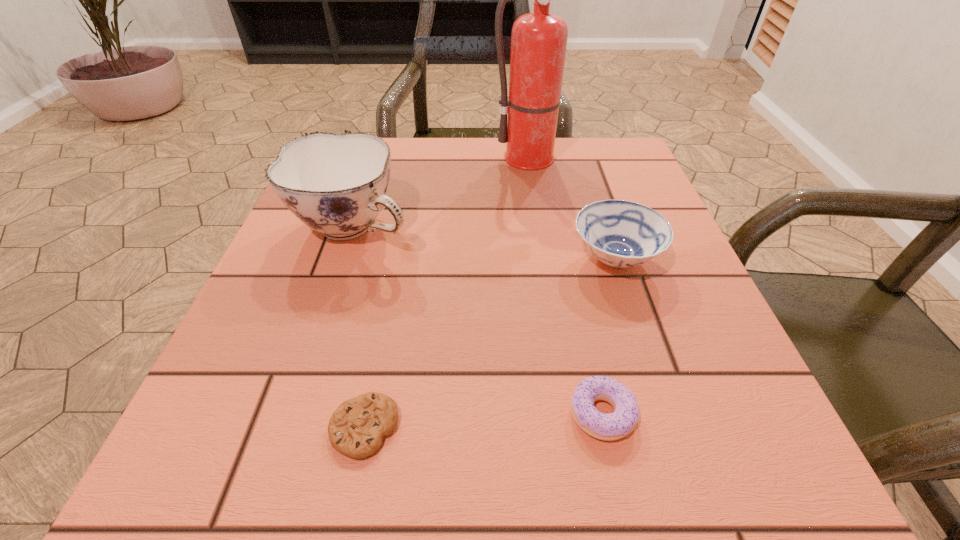
Find the location of a particular element. the tallest object is located at coordinates (539, 39).

You are a GUI agent. You are given a task and a screenshot of the screen. Output one action in this format:
    pyautogui.click(x=<x>, y=<y>)
    Task: Click on the fire extinguisher
    Image resolution: width=960 pixels, height=540 pixels.
    Given the screenshot: What is the action you would take?
    pyautogui.click(x=539, y=39)

At what (x,y) coordinates should I click in order to perform the action: click on chinaware. Please return your answer as a coordinate pair (x, y). This screenshot has width=960, height=540. Looking at the image, I should click on (336, 184).

This screenshot has width=960, height=540. Find the location of `the third shortest object`. the third shortest object is located at coordinates (620, 233).

In order to click on the second shortest object in this screenshot , I will do `click(608, 427)`.

The height and width of the screenshot is (540, 960). What are the coordinates of `cookie` in the screenshot? It's located at (356, 429).

The width and height of the screenshot is (960, 540). Identify the location of free space located with the handle and hose on the tallest object. (553, 248).

Identify the location of vacant space located on the front of the chinaware. This screenshot has height=540, width=960. (318, 338).

I want to click on blank space located 0.060m on the back of the soup bowl, so click(x=599, y=212).

Where is `vacant space situated on the back of the second shortest object`? vacant space situated on the back of the second shortest object is located at coordinates (562, 226).